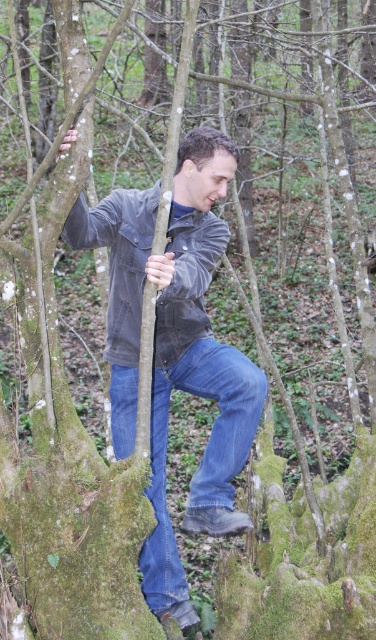
Question: Estimate the real-world distances between objects in this image. Which object is farther from the washed denim jacket at center?

Choices:
 (A) blue denim jeans at center
 (B) denim jacket at center

Answer: (A)

Question: Is denim jacket at center wider than washed denim jacket at center?

Choices:
 (A) no
 (B) yes

Answer: (B)

Question: Can you confirm if denim jacket at center is positioned to the left of washed denim jacket at center?

Choices:
 (A) yes
 (B) no

Answer: (B)

Question: Which of the following is the closest to the observer?

Choices:
 (A) denim jacket at center
 (B) washed denim jacket at center

Answer: (A)

Question: Which of the following is the farthest from the observer?

Choices:
 (A) (153, 205)
 (B) (156, 186)

Answer: (B)

Question: Can you confirm if denim jacket at center is positioned above blue denim jeans at center?

Choices:
 (A) yes
 (B) no

Answer: (A)